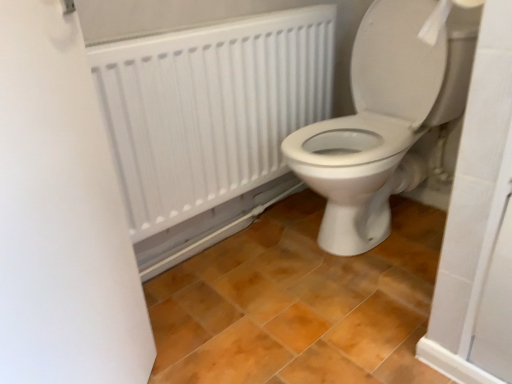
Question: Is brown matte tile at center oriented away from white matte screen door at left?

Choices:
 (A) no
 (B) yes

Answer: (A)

Question: Can you confirm if brown matte tile at center is smaller than white matte screen door at left?

Choices:
 (A) no
 (B) yes

Answer: (A)

Question: From the image's perspective, does brown matte tile at center appear higher than white matte screen door at left?

Choices:
 (A) yes
 (B) no

Answer: (B)

Question: Does brown matte tile at center come in front of white matte screen door at left?

Choices:
 (A) no
 (B) yes

Answer: (A)

Question: Does brown matte tile at center touch white matte screen door at left?

Choices:
 (A) no
 (B) yes

Answer: (A)

Question: Is brown matte tile at center oriented towards white matte screen door at left?

Choices:
 (A) yes
 (B) no

Answer: (A)

Question: Is white matte screen door at left placed right next to white matte radiator at upper center?

Choices:
 (A) no
 (B) yes

Answer: (A)

Question: From a real-world perspective, does white matte screen door at left sit lower than white matte radiator at upper center?

Choices:
 (A) yes
 (B) no

Answer: (A)

Question: Is white matte screen door at left behind white matte radiator at upper center?

Choices:
 (A) no
 (B) yes

Answer: (A)

Question: Is white matte screen door at left oriented away from white matte radiator at upper center?

Choices:
 (A) no
 (B) yes

Answer: (A)

Question: Does white matte screen door at left have a larger size compared to white matte radiator at upper center?

Choices:
 (A) yes
 (B) no

Answer: (B)

Question: Does white matte screen door at left have a lesser height compared to white matte radiator at upper center?

Choices:
 (A) yes
 (B) no

Answer: (B)

Question: Does white glossy toilet at center lie in front of brown matte tile at center?

Choices:
 (A) no
 (B) yes

Answer: (A)